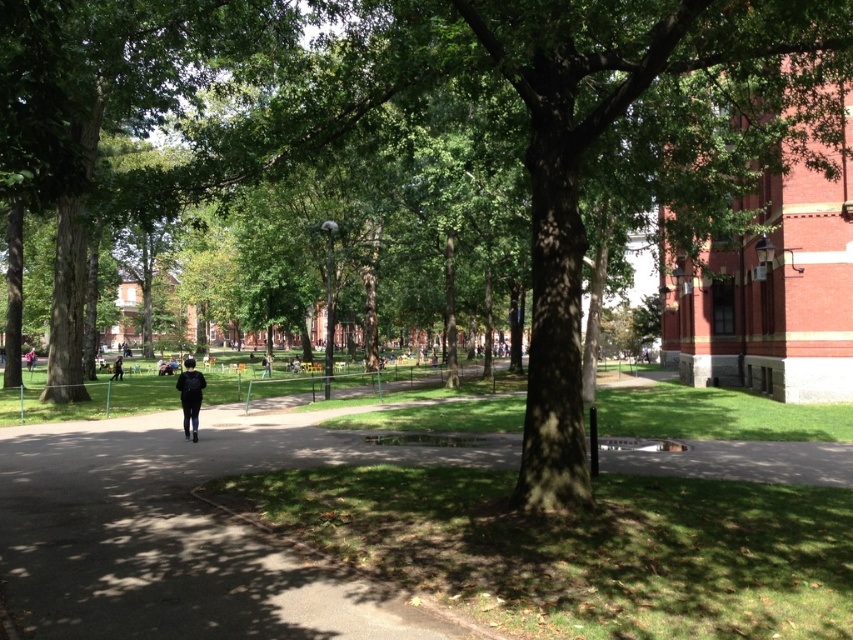
Who is higher up, dark blue jeans at center or black fabric backpack at center?

dark blue jeans at center

Does point (195, 376) lie in front of point (115, 372)?

Yes.

Where is `dark blue jeans at center`? dark blue jeans at center is located at coordinates (190, 396).

Between point (184, 381) and point (262, 376), which one is positioned behind?

The point (262, 376) is behind.

How distant is dark blue jeans at center from black backpack at center?

They are 16.90 meters apart.

In order to click on dark blue jeans at center in this screenshot , I will do `click(190, 396)`.

Between point (114, 371) and point (263, 364), which one is positioned behind?

Positioned behind is point (263, 364).

How distant is black fabric backpack at center from black backpack at center?

They are 10.04 meters apart.

Who is more distant from viewer, (117, 378) or (271, 356)?

The point (271, 356) is behind.

Locate an element on the screen. The image size is (853, 640). black fabric backpack at center is located at coordinates (117, 369).